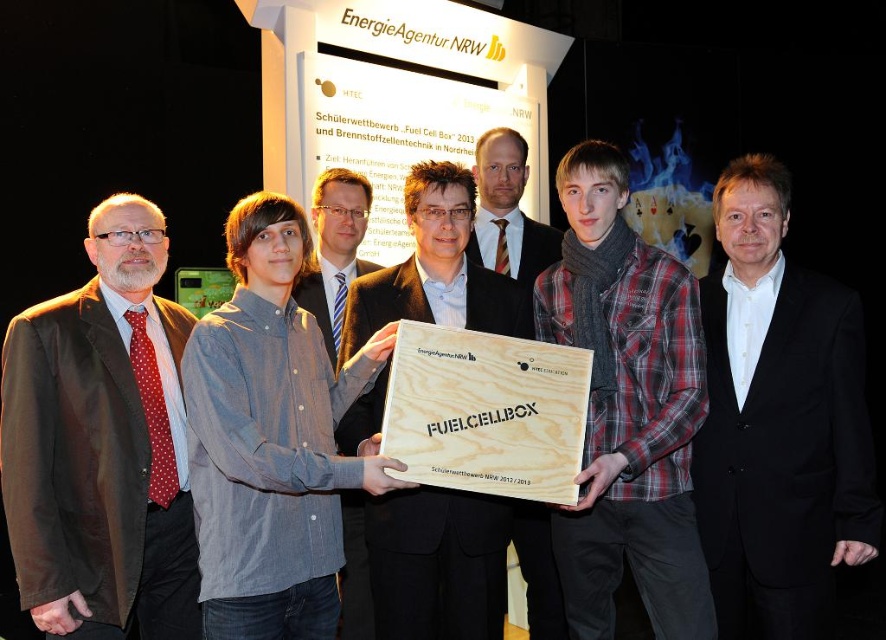
You are a photographer at the event and want to adjust the lighting so that the brown fabric coat at left and the matte black jacket at center are both well lit. Which object should you focus the light on first to ensure both are properly illuminated?

The brown fabric coat at left is positioned under matte black jacket at center, so you should focus the light on the matte black jacket at center first to ensure both receive adequate illumination.

You are a photographer at the event and need to adjust the lighting so that the matte wood plaque at center and the denim shirt at center are both visible. Since the plaque is on the right of the shirt, where should you place the light source to ensure both objects are well lit?

The matte wood plaque at center is positioned on the right side of denim shirt at center. To ensure both are well lit, place the light source to the left of the denim shirt at center so that it illuminates both the shirt and the plaque on its right side.

You are a photographer at the event and need to ensure that the matte wood plaque at center and the denim shirt at center are both visible in the photo. Based on their sizes, which object should you focus on to ensure both are in frame?

The matte wood plaque at center is taller than the denim shirt at center, so focusing on the taller plaque ensures both are visible.